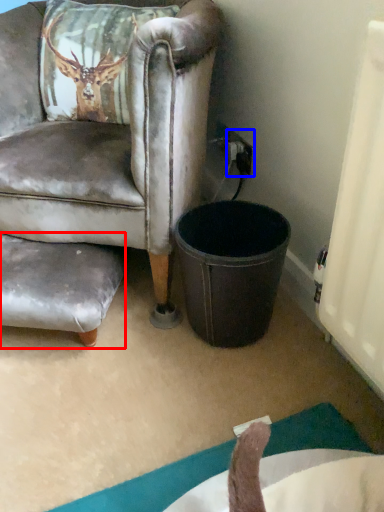
Question: Which of the following is the farthest to the observer, swivel chair (highlighted by a red box) or power outlet (highlighted by a blue box)?

Choices:
 (A) swivel chair
 (B) power outlet

Answer: (B)